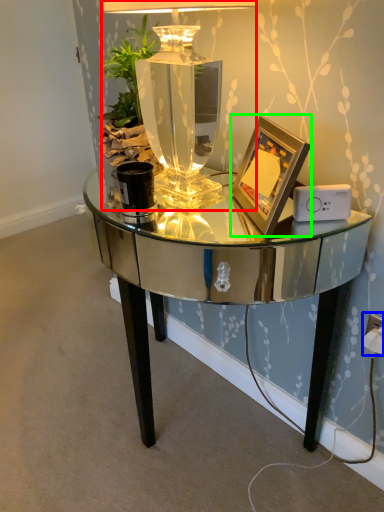
Question: Considering the real-world distances, which object is farthest from table lamp (highlighted by a red box)? electric outlet (highlighted by a blue box) or picture frame (highlighted by a green box)?

Choices:
 (A) electric outlet
 (B) picture frame

Answer: (A)